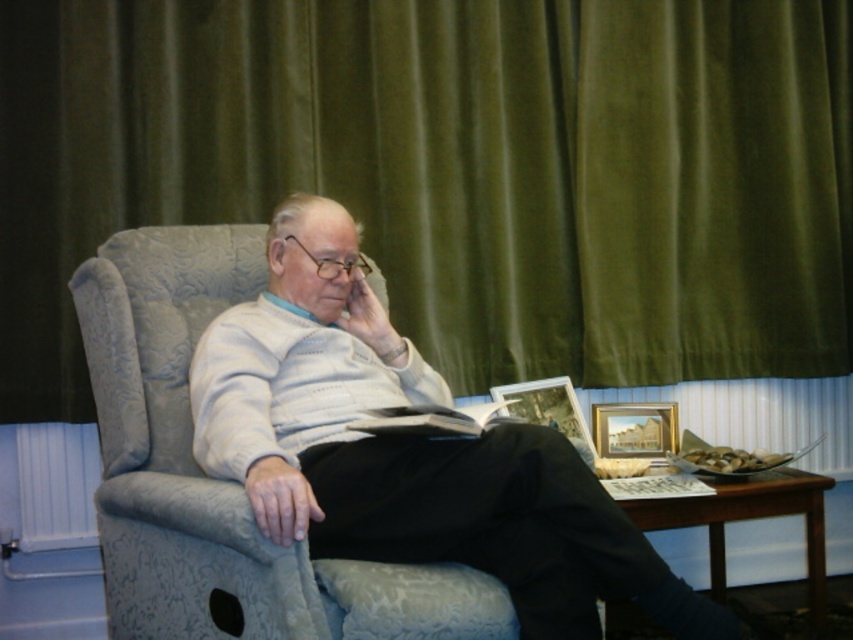
Question: Which object appears closest to the camera in this image?

Choices:
 (A) light gray fabric chair at center
 (B) velvet green curtain at upper center
 (C) wooden picture frame at lower right

Answer: (A)

Question: Can you confirm if velvet green curtain at upper center is positioned to the left of wooden picture frame at lower right?

Choices:
 (A) yes
 (B) no

Answer: (A)

Question: Does velvet green curtain at upper center have a larger size compared to light gray fabric chair at center?

Choices:
 (A) no
 (B) yes

Answer: (B)

Question: Which is farther from the light gray fabric chair at center?

Choices:
 (A) velvet green curtain at upper center
 (B) wooden picture frame at lower right

Answer: (A)

Question: Where is velvet green curtain at upper center located in relation to gold-framed picture at right in the image?

Choices:
 (A) below
 (B) above

Answer: (B)

Question: Which point is closer to the camera?

Choices:
 (A) (244, 486)
 (B) (654, 410)
 (C) (73, 243)

Answer: (A)